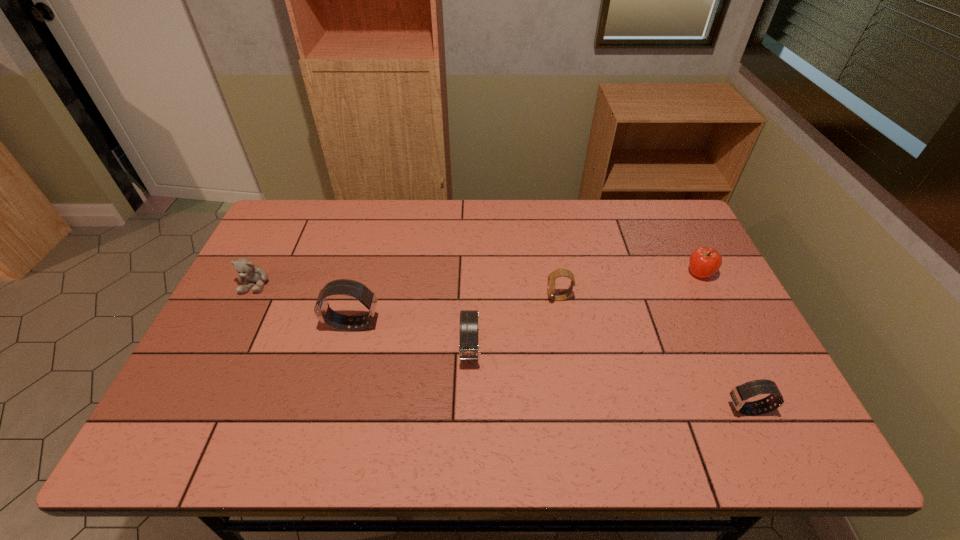
At what (x,y) coordinates should I click in order to perform the action: click on vacant space positioned 0.180m on the face of the tallest object. Please return your answer as a coordinate pair (x, y). The height and width of the screenshot is (540, 960). Looking at the image, I should click on (258, 325).

You are a GUI agent. You are given a task and a screenshot of the screen. Output one action in this format:
    pyautogui.click(x=<x>, y=<y>)
    Task: Click on the vacant area located on the face of the tallest object
    This screenshot has height=540, width=960.
    Given the screenshot: What is the action you would take?
    pyautogui.click(x=240, y=325)

I want to click on free space located 0.060m on the face of the tallest object, so click(x=302, y=325).

At what (x,y) coordinates should I click in order to perform the action: click on vacant region located 0.100m on the face of the third shortest watch. Please return your answer as a coordinate pair (x, y). The image size is (960, 540). Looking at the image, I should click on (469, 408).

At what (x,y) coordinates should I click in order to perform the action: click on free location located on the face of the nearest object. Please return your answer as a coordinate pair (x, y). The height and width of the screenshot is (540, 960). Looking at the image, I should click on (665, 410).

Where is `vacant position located 0.110m on the face of the nearest object`? The width and height of the screenshot is (960, 540). vacant position located 0.110m on the face of the nearest object is located at coordinates point(679,410).

Find the location of a particular element. This screenshot has height=540, width=960. free space located 0.260m on the face of the nearest object is located at coordinates (613, 410).

This screenshot has width=960, height=540. I want to click on vacant region located 0.260m on the front of the apple, so click(741, 357).

At what (x,y) coordinates should I click in order to perform the action: click on free region located on the face of the farthest watch. Please return your answer as a coordinate pair (x, y). Looking at the image, I should click on (419, 298).

In order to click on free spot located on the face of the farthest watch in this screenshot , I will do `click(481, 298)`.